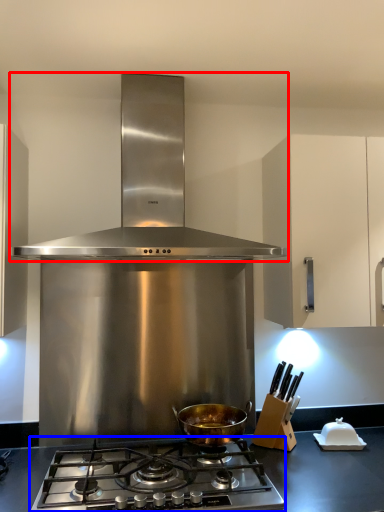
Question: Which object is further to the camera taking this photo, kitchen appliance (highlighted by a red box) or gas stove (highlighted by a blue box)?

Choices:
 (A) kitchen appliance
 (B) gas stove

Answer: (A)